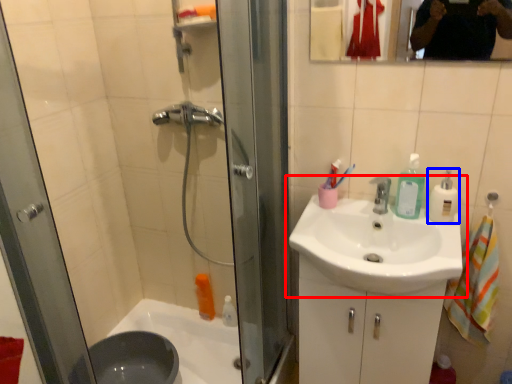
Question: Which point is further to the camera, sink (highlighted by a red box) or cleaning product (highlighted by a blue box)?

Choices:
 (A) sink
 (B) cleaning product

Answer: (B)